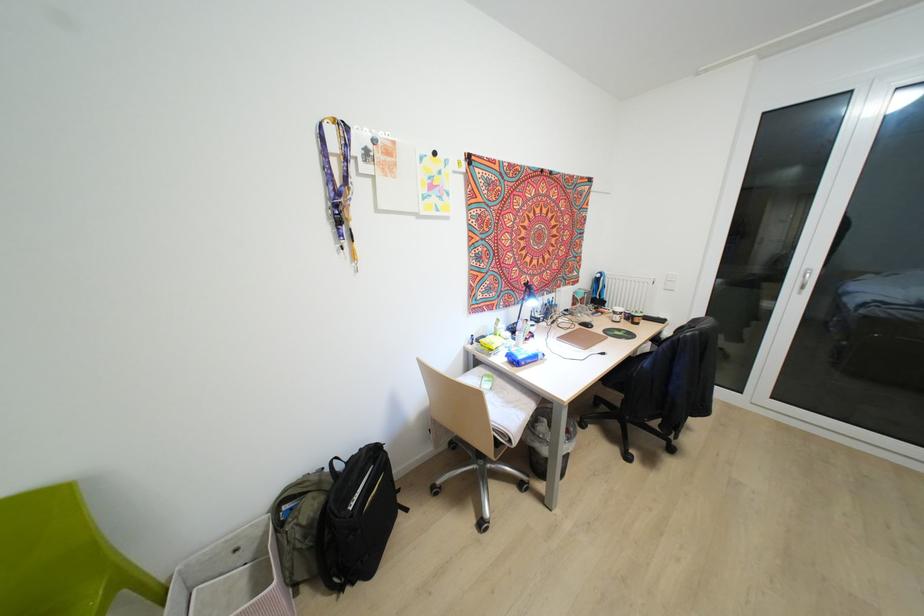
At what (x,y) coordinates should I click in order to perform the action: click on blue water bottle. Please return your answer as a coordinate pair (x, y). The image size is (924, 616). Looking at the image, I should click on (553, 305).